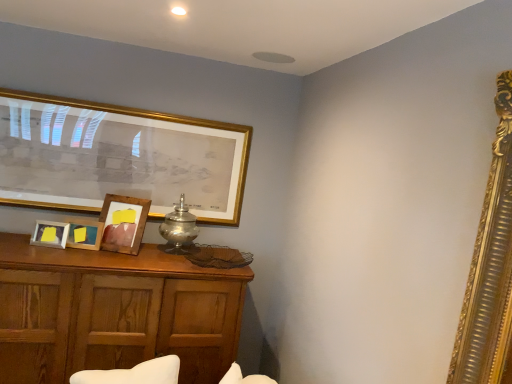
Identify the location of vacant space to the left of silver metallic table lamp at center. (149, 244).